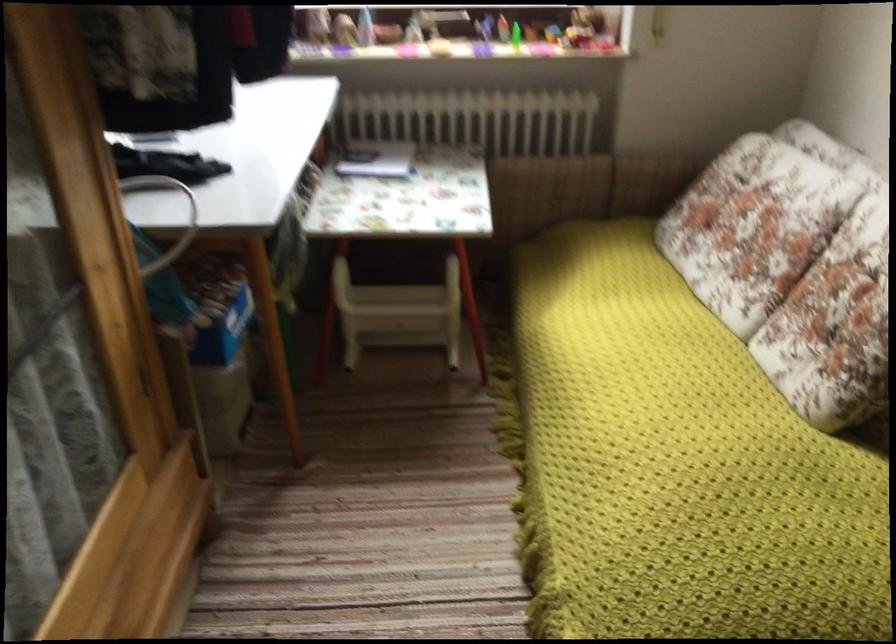
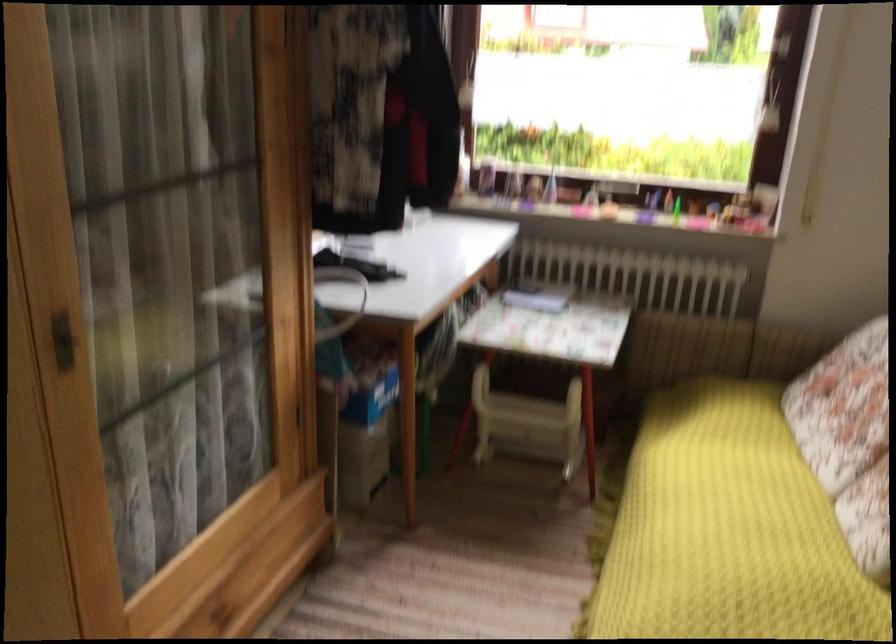
In the second image, find the point that corresponds to point (402, 317) in the first image.

(528, 424)